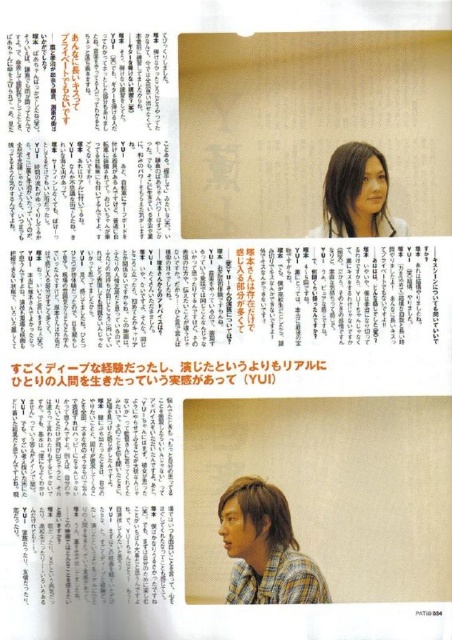
Is point (28, 362) positioned before point (273, 552)?

That is False.

Between yellow papertexturedpaper at upper center and plaid cotton shirt at lower right, which one appears on the left side from the viewer's perspective?

yellow papertexturedpaper at upper center is more to the left.

Who is more forward, (187, 369) or (302, 556)?

Point (302, 556) is in front.

In order to click on yellow papertexturedpaper at upper center in this screenshot , I will do point(158,372).

Is yellow papertexturedpaper at upper center to the left of smooth brown hair at upper center from the viewer's perspective?

Indeed, yellow papertexturedpaper at upper center is positioned on the left side of smooth brown hair at upper center.

Who is more distant from viewer, (249, 369) or (334, 220)?

Positioned behind is point (334, 220).

Find the location of a particular element. This screenshot has height=640, width=452. yellow papertexturedpaper at upper center is located at coordinates (158, 372).

Is smooth brown hair at upper center taller than plaid cotton shirt at lower right?

Correct, smooth brown hair at upper center is much taller as plaid cotton shirt at lower right.

Who is more distant from viewer, (329, 172) or (314, 600)?

Positioned behind is point (329, 172).

Is point (334, 227) in front of point (282, 580)?

That is False.

I want to click on smooth brown hair at upper center, so click(357, 195).